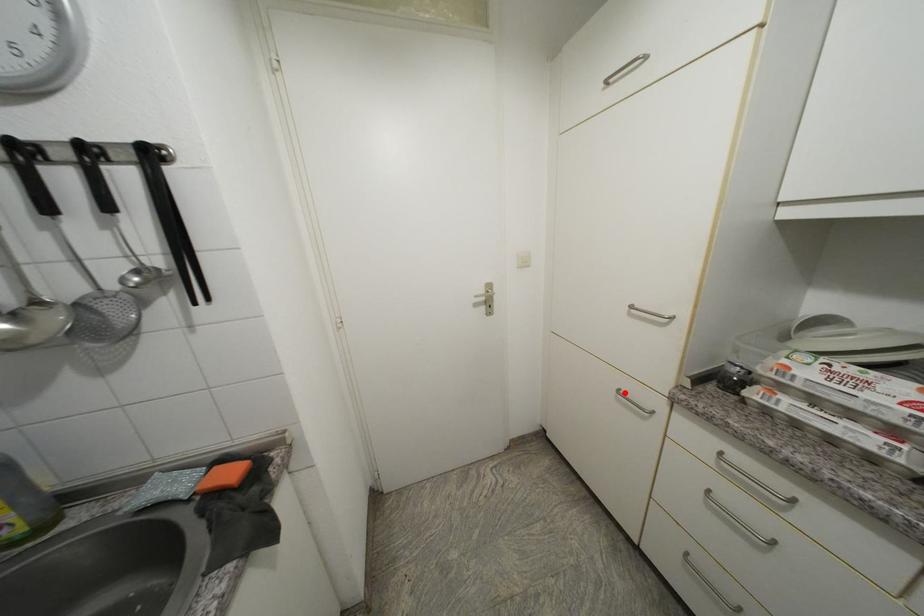
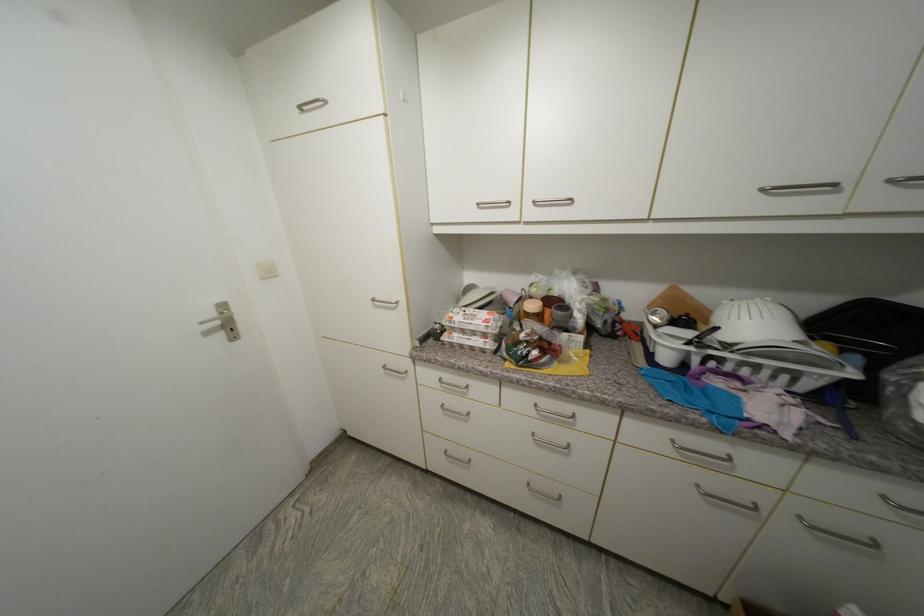
Locate, in the second image, the point that corresponds to the highlighted location in the first image.

(390, 369)